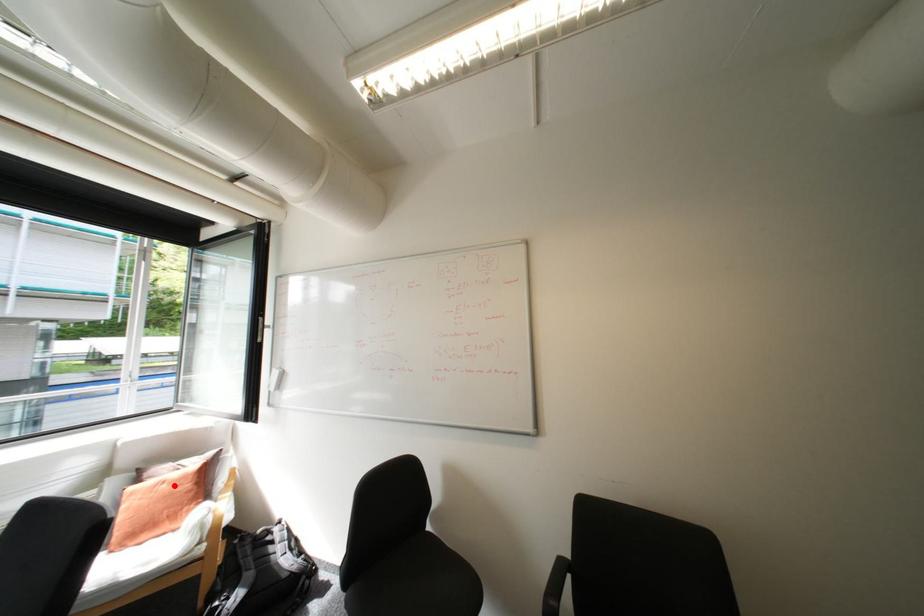
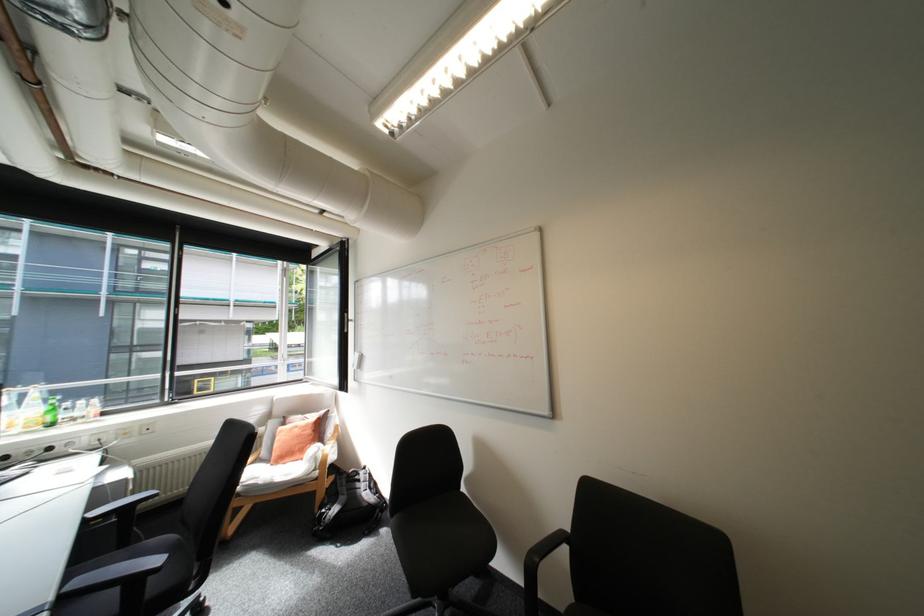
In the second image, find the point that corresponds to the highlighted location in the first image.

(307, 429)